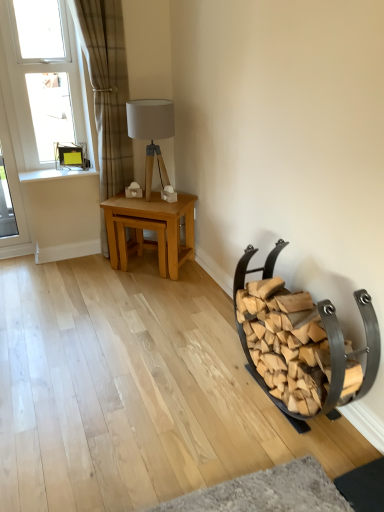
The width and height of the screenshot is (384, 512). Find the location of `blank space to the left of wooden firewood rack at lower right`. blank space to the left of wooden firewood rack at lower right is located at coordinates (186, 413).